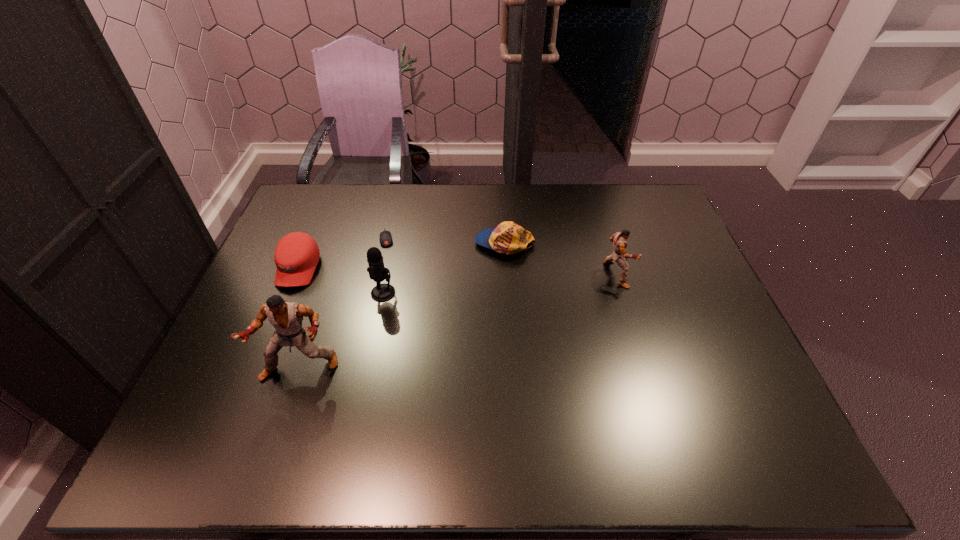
What are the coordinates of `free space located 0.310m on the bill of the right cap` in the screenshot? It's located at (375, 244).

The height and width of the screenshot is (540, 960). I want to click on vacant region located 0.180m on the bill of the right cap, so click(x=418, y=244).

The image size is (960, 540). I want to click on free space located on the bill of the right cap, so click(446, 244).

Locate an element on the screen. The height and width of the screenshot is (540, 960). vacant area situated on the right of the microphone is located at coordinates (514, 293).

You are a GUI agent. You are given a task and a screenshot of the screen. Output one action in this format:
    pyautogui.click(x=<x>, y=<y>)
    Task: Click on the vacant space located 0.220m on the front-facing side of the left cap
    
    Given the screenshot: What is the action you would take?
    pyautogui.click(x=261, y=357)

Locate an element on the screen. free space located on the right of the shortest object is located at coordinates (x=457, y=238).

Identify the location of object that is at the near edge. Image resolution: width=960 pixels, height=540 pixels. (286, 317).

Where is `puncher positioned at the left edge`? This screenshot has width=960, height=540. puncher positioned at the left edge is located at coordinates (286, 317).

Find the location of a particular element. The width and height of the screenshot is (960, 540). cap present at the left edge is located at coordinates (296, 255).

At what (x,y) coordinates should I click in order to perform the action: click on object that is at the near left corner. Please return your answer as a coordinate pair (x, y). Looking at the image, I should click on point(286,317).